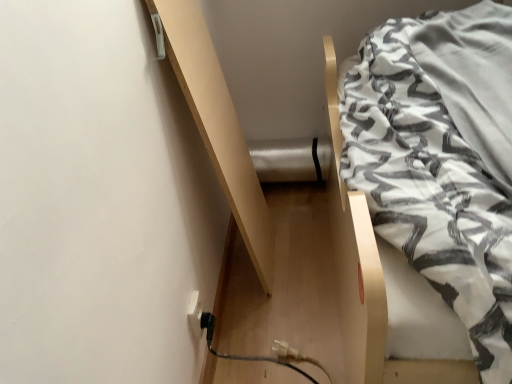
Question: Is white textured fabric at upper right turned away from light wood shelf at upper left?

Choices:
 (A) yes
 (B) no

Answer: (B)

Question: From a real-world perspective, does white textured fabric at upper right stand above light wood shelf at upper left?

Choices:
 (A) no
 (B) yes

Answer: (A)

Question: Does white textured fabric at upper right have a greater width compared to light wood shelf at upper left?

Choices:
 (A) no
 (B) yes

Answer: (B)

Question: Is white textured fabric at upper right smaller than light wood shelf at upper left?

Choices:
 (A) yes
 (B) no

Answer: (B)

Question: Is white textured fabric at upper right surrounding light wood shelf at upper left?

Choices:
 (A) yes
 (B) no

Answer: (B)

Question: Is white textured fabric at upper right to the left or to the right of white plastic electric outlet at lower left in the image?

Choices:
 (A) left
 (B) right

Answer: (B)

Question: Relative to white plastic electric outlet at lower left, is white textured fabric at upper right in front or behind?

Choices:
 (A) front
 (B) behind

Answer: (A)

Question: Is point (398, 56) closer or farther from the camera than point (198, 304)?

Choices:
 (A) closer
 (B) farther

Answer: (A)

Question: Looking at their shapes, would you say white textured fabric at upper right is wider or thinner than white plastic electric outlet at lower left?

Choices:
 (A) thin
 (B) wide

Answer: (B)

Question: Is light wood shelf at upper left wider or thinner than white textured fabric at upper right?

Choices:
 (A) thin
 (B) wide

Answer: (A)

Question: From a real-world perspective, is light wood shelf at upper left physically located above or below white textured fabric at upper right?

Choices:
 (A) below
 (B) above

Answer: (B)

Question: From their relative heights in the image, would you say light wood shelf at upper left is taller or shorter than white textured fabric at upper right?

Choices:
 (A) tall
 (B) short

Answer: (A)

Question: Would you say light wood shelf at upper left is to the left or to the right of white textured fabric at upper right in the picture?

Choices:
 (A) left
 (B) right

Answer: (A)

Question: Looking at their shapes, would you say white textured fabric at upper right is wider or thinner than light wood shelf at upper left?

Choices:
 (A) wide
 (B) thin

Answer: (A)

Question: In the image, is white textured fabric at upper right positioned in front of or behind light wood shelf at upper left?

Choices:
 (A) behind
 (B) front

Answer: (B)